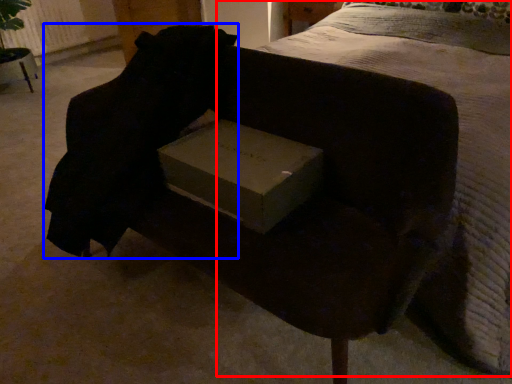
Question: Among these objects, which one is farthest to the camera, bed (highlighted by a red box) or back (highlighted by a blue box)?

Choices:
 (A) bed
 (B) back

Answer: (B)